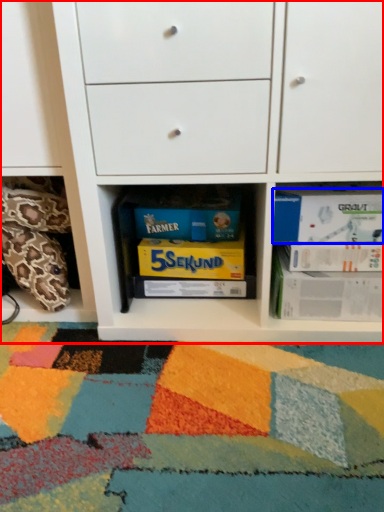
Question: Which object is closer to the camera taking this photo, chest of drawers (highlighted by a red box) or paperback book (highlighted by a blue box)?

Choices:
 (A) chest of drawers
 (B) paperback book

Answer: (A)